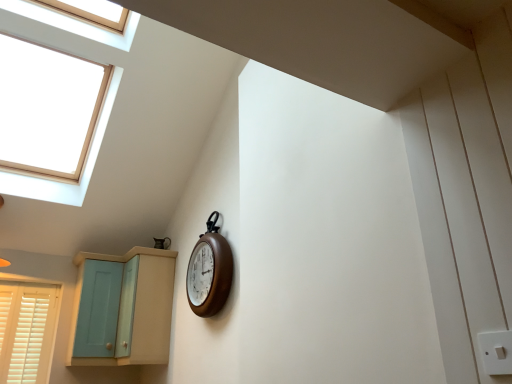
Question: From the image's perspective, is light teal wood cabinet at lower left positioned above or below wooden clock at center?

Choices:
 (A) above
 (B) below

Answer: (B)

Question: Considering their positions, is light teal wood cabinet at lower left located in front of or behind wooden clock at center?

Choices:
 (A) front
 (B) behind

Answer: (B)

Question: Estimate the real-world distances between objects in this image. Which object is farther from the white plastic switch at lower right?

Choices:
 (A) light teal wood cabinet at lower left
 (B) wooden clock at center
 (C) light blue wood cabinet at lower left

Answer: (C)

Question: Which is farther from the wooden clock at center?

Choices:
 (A) light blue wood cabinet at lower left
 (B) white plastic switch at lower right
 (C) light teal wood cabinet at lower left

Answer: (B)